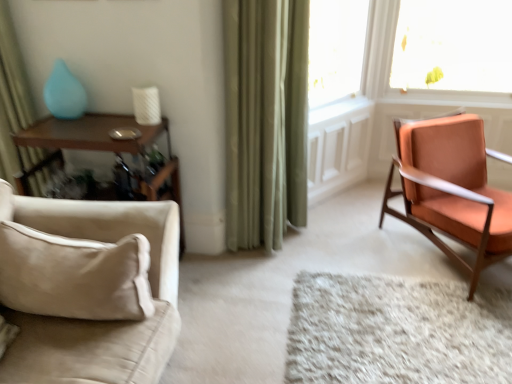
Question: From the image's perspective, is white shag rug at center located beneath orange fabric chair at right, arranged as the first chair when viewed from the right?

Choices:
 (A) no
 (B) yes

Answer: (B)

Question: Can you see white shag rug at center touching orange fabric chair at right, the 1th chair positioned from the back?

Choices:
 (A) no
 (B) yes

Answer: (A)

Question: Considering the relative positions of white shag rug at center and orange fabric chair at right, which ranks as the 2th chair in front-to-back order, in the image provided, is white shag rug at center to the left of orange fabric chair at right, which ranks as the 2th chair in front-to-back order, from the viewer's perspective?

Choices:
 (A) no
 (B) yes

Answer: (B)

Question: Would you say white shag rug at center is a long distance from orange fabric chair at right, arranged as the first chair when viewed from the right?

Choices:
 (A) no
 (B) yes

Answer: (A)

Question: Can you confirm if white shag rug at center is taller than orange fabric chair at right, which ranks as the 2th chair in front-to-back order?

Choices:
 (A) no
 (B) yes

Answer: (A)

Question: Considering the positions of point (0, 72) and point (59, 339), is point (0, 72) closer or farther from the camera than point (59, 339)?

Choices:
 (A) farther
 (B) closer

Answer: (A)

Question: In the image, is green fabric curtain at left, which is counted as the 1th curtain, starting from the left, positioned in front of or behind beige fabric couch at lower left, which is the second chair in right-to-left order?

Choices:
 (A) behind
 (B) front

Answer: (A)

Question: Is green fabric curtain at left, which is counted as the 1th curtain, starting from the left, spatially inside beige fabric couch at lower left, which appears as the first chair when viewed from the left, or outside of it?

Choices:
 (A) outside
 (B) inside

Answer: (A)

Question: In terms of height, does green fabric curtain at left, which is counted as the 1th curtain, starting from the left, look taller or shorter compared to beige fabric couch at lower left, which is the first chair in front-to-back order?

Choices:
 (A) short
 (B) tall

Answer: (B)

Question: From a real-world perspective, is orange fabric chair at right, arranged as the first chair when viewed from the right, physically located above or below woodenmaterial/texturetable at left?

Choices:
 (A) above
 (B) below

Answer: (B)

Question: From their relative heights in the image, would you say orange fabric chair at right, the 1th chair positioned from the back, is taller or shorter than woodenmaterial/texturetable at left?

Choices:
 (A) short
 (B) tall

Answer: (A)

Question: From the image's perspective, relative to woodenmaterial/texturetable at left, is orange fabric chair at right, the 1th chair positioned from the back, above or below?

Choices:
 (A) above
 (B) below

Answer: (A)

Question: Is point (508, 195) positioned closer to the camera than point (159, 180)?

Choices:
 (A) closer
 (B) farther

Answer: (B)

Question: In terms of size, does white shag rug at center appear bigger or smaller than green velvet curtain at center, acting as the 1th curtain starting from the right?

Choices:
 (A) big
 (B) small

Answer: (B)

Question: From the image's perspective, is white shag rug at center positioned above or below green velvet curtain at center, which is the second curtain from left to right?

Choices:
 (A) above
 (B) below

Answer: (B)